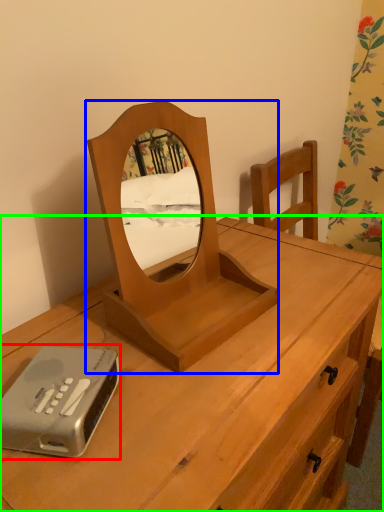
Question: Which is farther away from gadget (highlighted by a red box)? mirror (highlighted by a blue box) or desk (highlighted by a green box)?

Choices:
 (A) mirror
 (B) desk

Answer: (B)